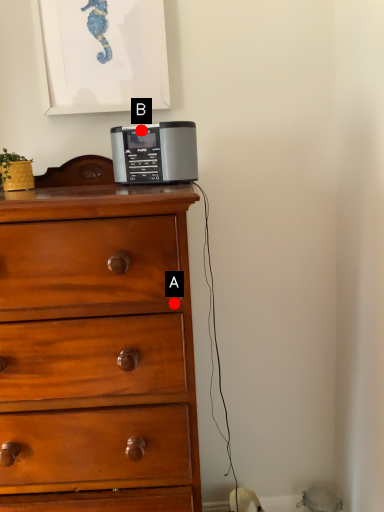
Question: Two points are circled on the image, labeled by A and B beside each circle. Which point appears closest to the camera in this image?

Choices:
 (A) A is closer
 (B) B is closer

Answer: (A)